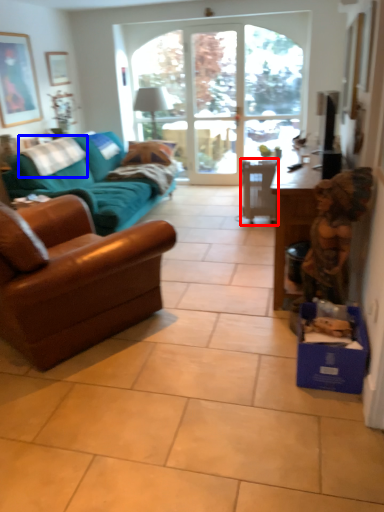
Question: Among these objects, which one is farthest to the camera, chair (highlighted by a red box) or pillow (highlighted by a blue box)?

Choices:
 (A) chair
 (B) pillow

Answer: (A)